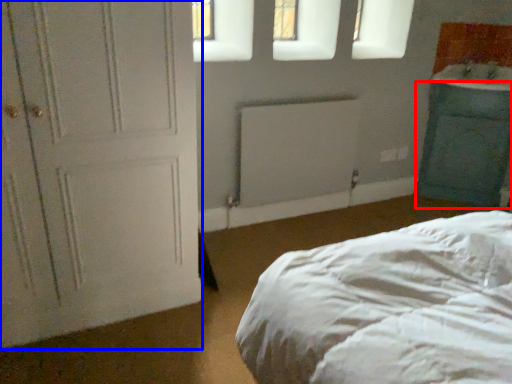
Question: Which object appears farthest to the camera in this image, cabinetry (highlighted by a red box) or door (highlighted by a blue box)?

Choices:
 (A) cabinetry
 (B) door

Answer: (A)